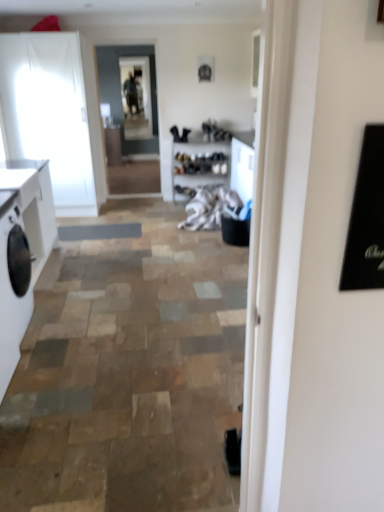
Question: From the image's perspective, is white glossy counter top at left below white matte washing machine at left?

Choices:
 (A) no
 (B) yes

Answer: (A)

Question: Does white glossy counter top at left contain white matte washing machine at left?

Choices:
 (A) no
 (B) yes

Answer: (A)

Question: Is white glossy counter top at left far away from white matte washing machine at left?

Choices:
 (A) no
 (B) yes

Answer: (A)

Question: Can you confirm if white glossy counter top at left is positioned to the left of white matte washing machine at left?

Choices:
 (A) no
 (B) yes

Answer: (B)

Question: Can you confirm if white glossy counter top at left is smaller than white matte washing machine at left?

Choices:
 (A) yes
 (B) no

Answer: (A)

Question: Is white glossy counter top at left to the right of white matte washing machine at left from the viewer's perspective?

Choices:
 (A) no
 (B) yes

Answer: (A)

Question: Does white matte cabinet at left, marked as the first cabinetry in a front-to-back arrangement, have a lesser width compared to clear glass door at center?

Choices:
 (A) no
 (B) yes

Answer: (A)

Question: Does white matte cabinet at left, acting as the second cabinetry starting from the top, come in front of clear glass door at center?

Choices:
 (A) no
 (B) yes

Answer: (B)

Question: Is the position of white matte cabinet at left, the second cabinetry when ordered from back to front, more distant than that of clear glass door at center?

Choices:
 (A) no
 (B) yes

Answer: (A)

Question: Does white matte cabinet at left, acting as the first cabinetry starting from the bottom, have a larger size compared to clear glass door at center?

Choices:
 (A) no
 (B) yes

Answer: (B)

Question: Is white matte cabinet at left, the second cabinetry when ordered from back to front, taller than clear glass door at center?

Choices:
 (A) no
 (B) yes

Answer: (A)

Question: Is clear glass door at center a part of white matte cabinet at left, marked as the first cabinetry in a front-to-back arrangement?

Choices:
 (A) no
 (B) yes

Answer: (A)

Question: From the image's perspective, is clear glass door at center located beneath white fabric at center?

Choices:
 (A) no
 (B) yes

Answer: (A)